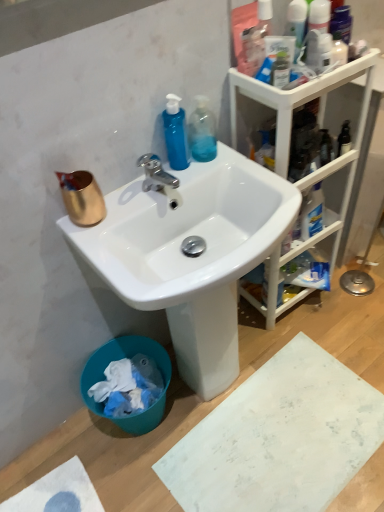
You are a GUI agent. You are given a task and a screenshot of the screen. Output one action in this format:
    pyautogui.click(x=<x>, y=<y>)
    Task: Click on the free area in between blue translucent bottle at upper center, positioned as the 2th cleaning product in right-to-left order, and copper metallic cup at upper left
    
    Given the screenshot: What is the action you would take?
    pyautogui.click(x=127, y=193)